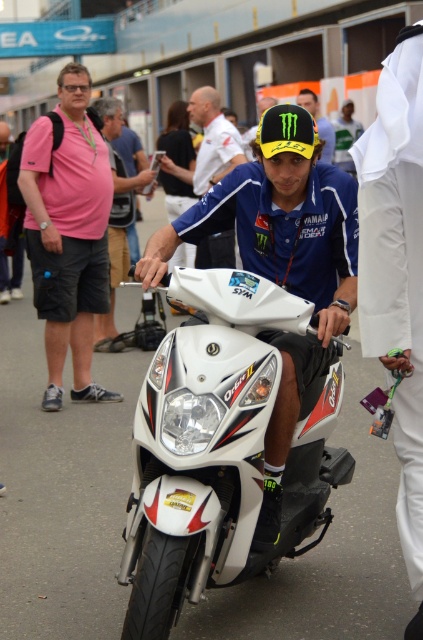
Which is more to the right, pink cotton shirt at left or yellow matte helmet at center?

yellow matte helmet at center is more to the right.

Consider the image. Can you confirm if pink cotton shirt at left is positioned below yellow matte helmet at center?

Yes.

Who is more distant from viewer, (85, 276) or (261, 100)?

Point (261, 100)

Find the location of a particular element. The image size is (423, 640). pink cotton shirt at left is located at coordinates (68, 234).

Who is more forward, (420, 432) or (307, 109)?

Positioned in front is point (420, 432).

Can you confirm if white matte motorcycle at center is wider than matte blue helmet at center?

No.

The height and width of the screenshot is (640, 423). In order to click on white matte motorcycle at center in this screenshot , I will do `click(397, 275)`.

Which of these two, white glossy motorcycle at center or yellow matte helmet at center, stands taller?

yellow matte helmet at center

Is white glossy motorcycle at center further to the viewer compared to yellow matte helmet at center?

That is False.

Does point (247, 538) come in front of point (264, 106)?

Yes, point (247, 538) is in front of point (264, 106).

Locate an element on the screen. Image resolution: width=423 pixels, height=640 pixels. white glossy motorcycle at center is located at coordinates (219, 449).